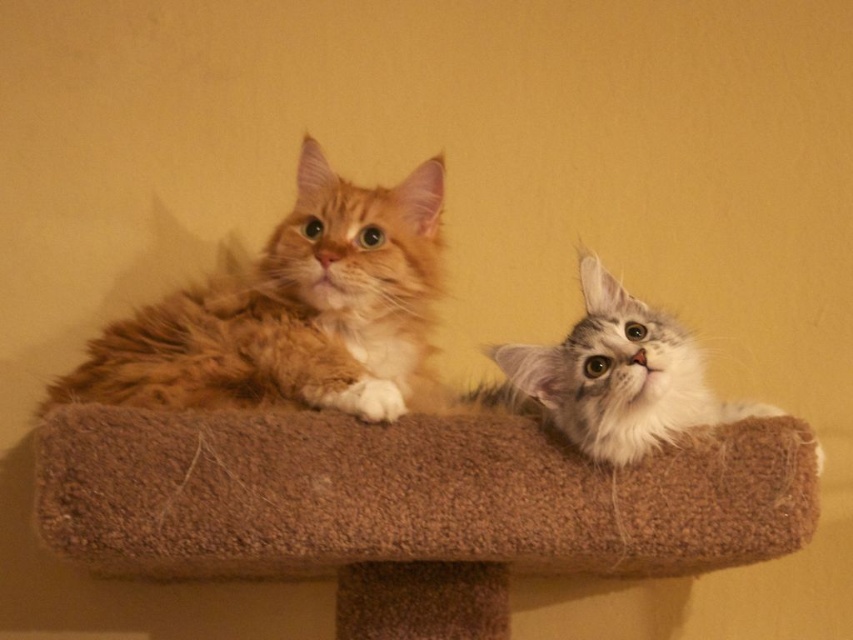
Question: Which object is farther from the camera taking this photo?

Choices:
 (A) orange fur cat at upper left
 (B) white fluffy cat at upper right
 (C) brown carpeted cat bed at center

Answer: (A)

Question: Which point appears closest to the camera in this image?

Choices:
 (A) (238, 282)
 (B) (82, 452)
 (C) (676, 394)

Answer: (B)

Question: Is orange fur cat at upper left thinner than white fluffy cat at upper right?

Choices:
 (A) yes
 (B) no

Answer: (B)

Question: Which point appears farthest from the camera in this image?

Choices:
 (A) (184, 397)
 (B) (608, 344)
 (C) (317, 496)

Answer: (A)

Question: Does brown carpeted cat bed at center have a lesser width compared to white fluffy cat at upper right?

Choices:
 (A) yes
 (B) no

Answer: (B)

Question: Considering the relative positions of orange fur cat at upper left and white fluffy cat at upper right in the image provided, where is orange fur cat at upper left located with respect to white fluffy cat at upper right?

Choices:
 (A) left
 (B) right

Answer: (A)